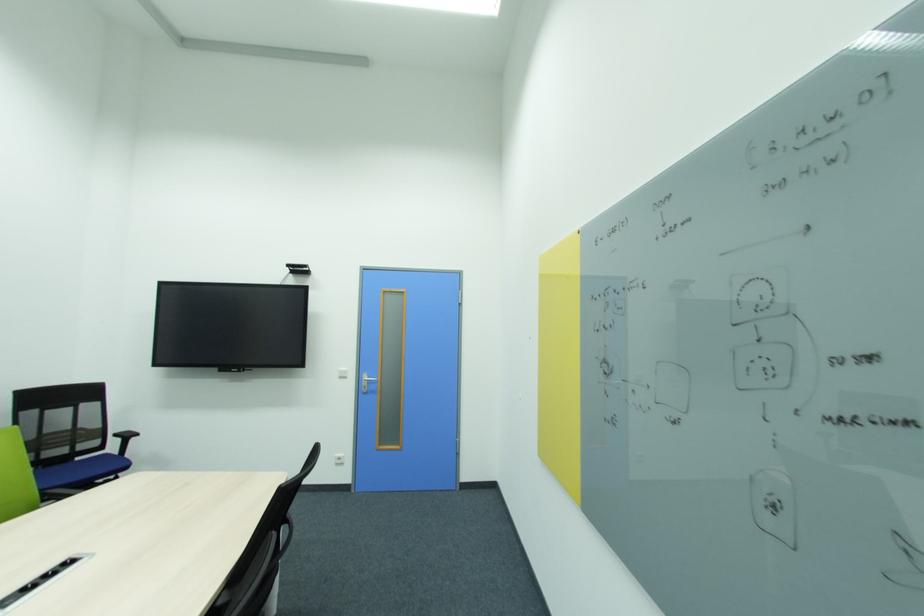
Identify the location of white light switch. The width and height of the screenshot is (924, 616). (600, 426).